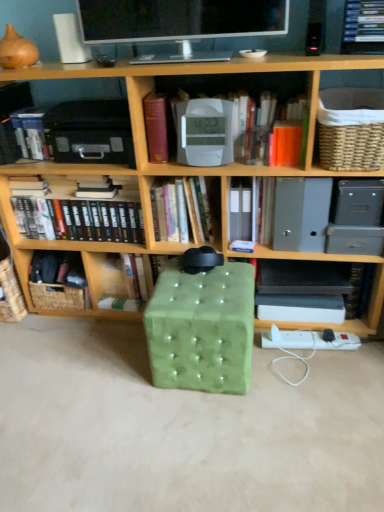
Find the location of `vacant region to the left of green velvet ottoman at center`. vacant region to the left of green velvet ottoman at center is located at coordinates (118, 372).